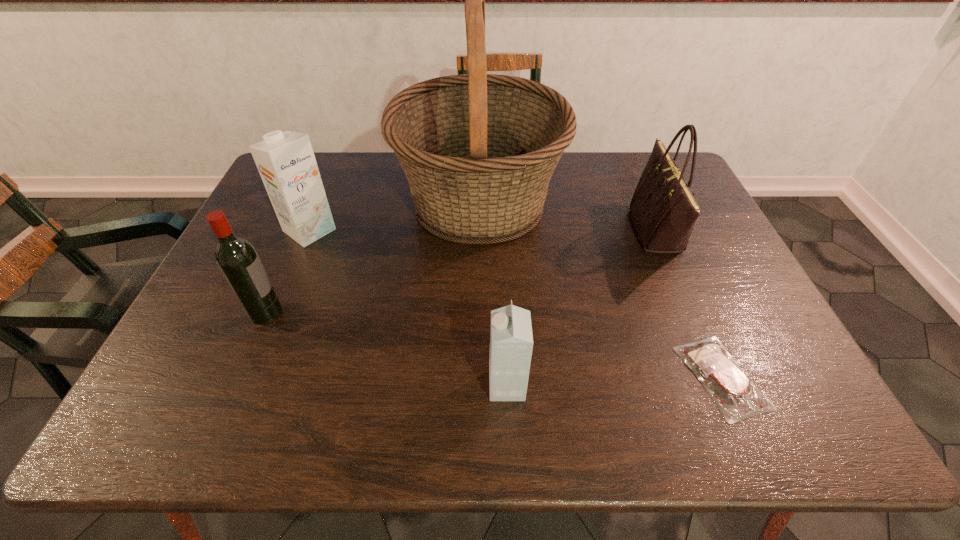
Where is `basket`? Image resolution: width=960 pixels, height=540 pixels. basket is located at coordinates (478, 150).

The width and height of the screenshot is (960, 540). In order to click on handbag in this screenshot , I will do `click(663, 210)`.

The width and height of the screenshot is (960, 540). In order to click on the taller carton in this screenshot , I will do `click(286, 162)`.

In order to click on the left carton in this screenshot , I will do `click(286, 162)`.

Identify the location of the third nearest object. (236, 257).

Locate an element on the screen. Image resolution: width=960 pixels, height=540 pixels. the nearer carton is located at coordinates (511, 340).

Locate an element on the screen. the shorter carton is located at coordinates (511, 340).

I want to click on the shortest object, so click(737, 398).

I want to click on vacant point located on the left of the basket, so click(x=315, y=204).

In order to click on free spot located 0.360m on the front-facing side of the handbag in this screenshot , I will do (x=509, y=230).